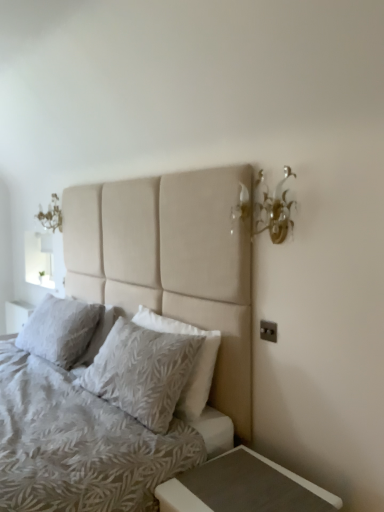
Question: From a real-world perspective, is matte gray wood nightstand at lower right above or below white frosted glass at upper left?

Choices:
 (A) above
 (B) below

Answer: (B)

Question: Is matte gray wood nightstand at lower right wider or thinner than white frosted glass at upper left?

Choices:
 (A) wide
 (B) thin

Answer: (A)

Question: Estimate the real-world distances between objects in this image. Which object is farther from the beige fabric bed at center?

Choices:
 (A) white textured pillow at center, positioned as the second pillow in right-to-left order
 (B) matte gray plastic electric outlet at lower right
 (C) gold metallic wall sconce at upper right
 (D) textured beige pillow at center, which appears as the first pillow when viewed from the right
 (E) matte gray wood nightstand at lower right

Answer: (B)

Question: Which object is the farthest from the white textured pillow at center, acting as the 1th pillow starting from the back?

Choices:
 (A) matte gray plastic electric outlet at lower right
 (B) textured beige pillow at center, placed as the 2th pillow when sorted from left to right
 (C) beige fabric bed at center
 (D) white frosted glass at upper left
 (E) gold metallic wall sconce at upper right

Answer: (D)